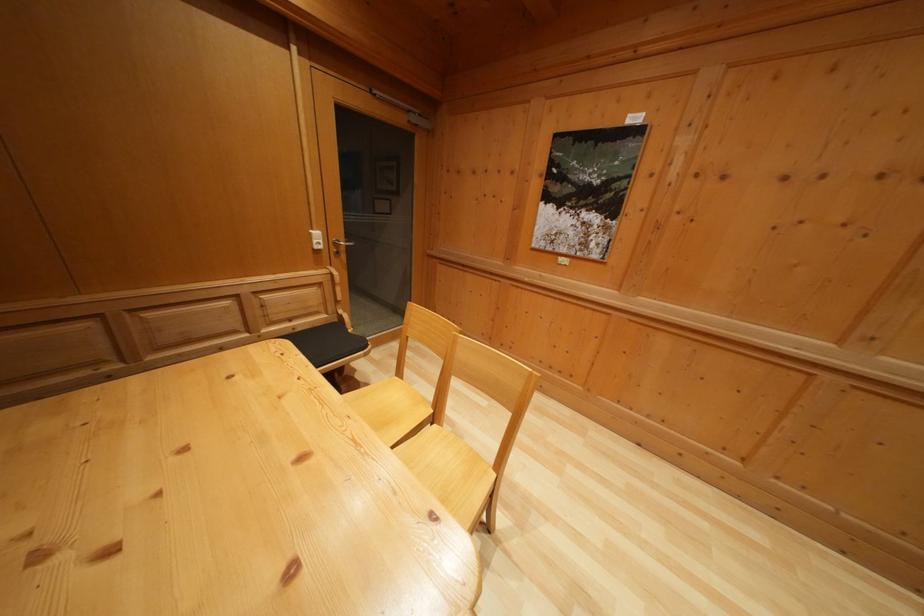
Find where to push the white light switch. Please return your answer as a coordinate pair (x, y).

(315, 238)